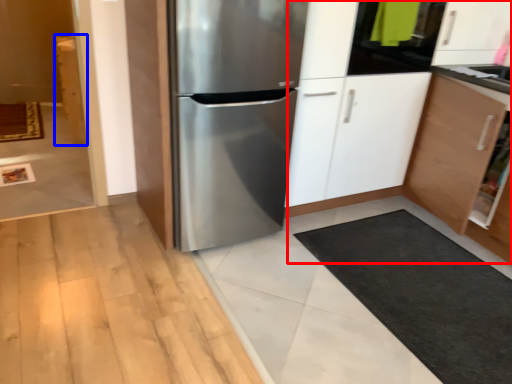
Question: Which of the following is the closest to the observer, dresser (highlighted by a red box) or cabinetry (highlighted by a blue box)?

Choices:
 (A) dresser
 (B) cabinetry

Answer: (A)